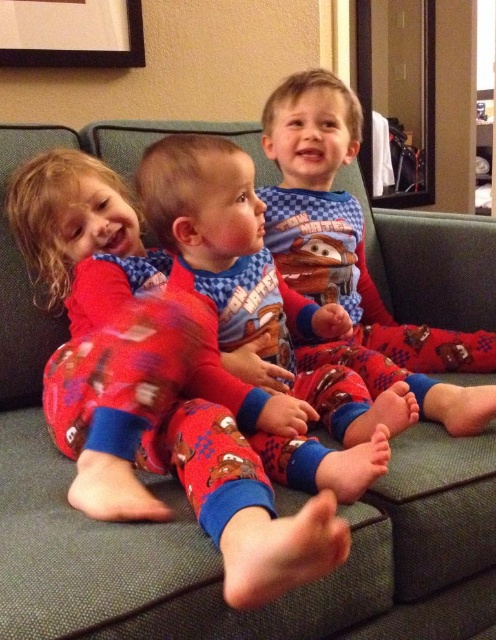
Which is behind, point (250, 177) or point (66, 58)?

The point (66, 58) is behind.

What do you see at coordinates (251, 275) in the screenshot? I see `matte red pajamas at center` at bounding box center [251, 275].

What do you see at coordinates (251, 275) in the screenshot? I see `matte red pajamas at center` at bounding box center [251, 275].

This screenshot has width=496, height=640. I want to click on matte red pajamas at center, so click(251, 275).

Does point (438, 412) come in front of point (66, 48)?

Yes.

This screenshot has width=496, height=640. I want to click on matte blue pajamas at center, so click(x=354, y=257).

Who is higher up, matte blue pajamas at center or matte red pajamas at center?

matte blue pajamas at center is higher up.

Is point (339, 150) more distant than point (226, 164)?

Yes, it is.

At what (x,y) coordinates should I click in order to perform the action: click on matte blue pajamas at center. Please return your answer as a coordinate pair (x, y). Looking at the image, I should click on (354, 257).